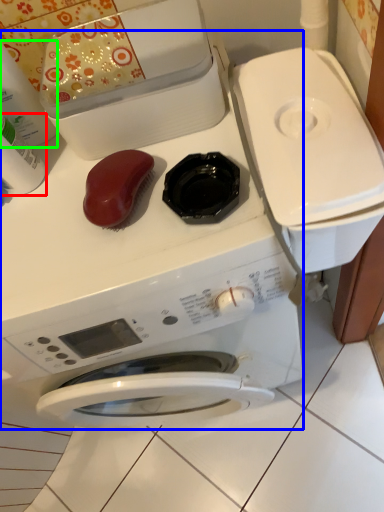
Question: Considering the real-world distances, which object is farthest from cleaning product (highlighted by a red box)? washing machine (highlighted by a blue box) or cleaning product (highlighted by a green box)?

Choices:
 (A) washing machine
 (B) cleaning product

Answer: (A)